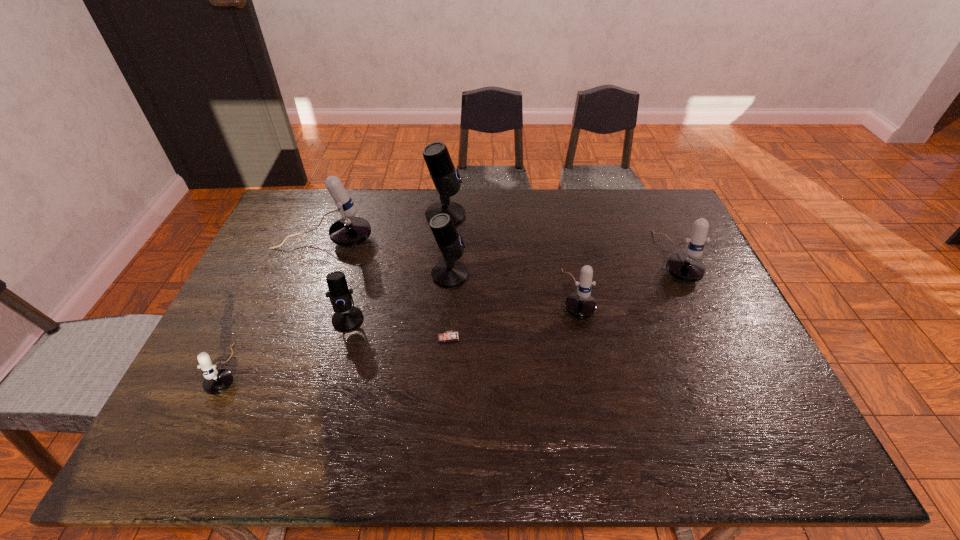
Point out which object is positioned as the sixth nearest to the leftmost black microphone. Please provide its 2D coordinates. Your answer should be formatted as a tuple, i.e. [(x, y)], where the tuple contains the x and y coordinates of a point satisfying the conditions above.

[(580, 304)]

This screenshot has height=540, width=960. I want to click on the fifth closest microphone relative to the farthest black microphone, so click(x=687, y=267).

Identify which microphone is the fifth nearest to the rightmost white microphone. Please provide its 2D coordinates. Your answer should be formatted as a tuple, i.e. [(x, y)], where the tuple contains the x and y coordinates of a point satisfying the conditions above.

[(350, 230)]

Select which black microphone is the closest to the seventh tallest object. Please provide its 2D coordinates. Your answer should be formatted as a tuple, i.e. [(x, y)], where the tuple contains the x and y coordinates of a point satisfying the conditions above.

[(346, 317)]

Locate an element on the screen. This screenshot has height=540, width=960. the third closest black microphone to the biggest white microphone is located at coordinates (346, 317).

You are a GUI agent. You are given a task and a screenshot of the screen. Output one action in this format:
    pyautogui.click(x=<x>, y=<y>)
    Task: Click on the white microphone that is the second closest to the farthest black microphone
    Image resolution: width=960 pixels, height=540 pixels.
    Given the screenshot: What is the action you would take?
    pyautogui.click(x=580, y=304)

The height and width of the screenshot is (540, 960). What are the coordinates of `white microphone that is the third closest to the shortest object` in the screenshot? It's located at (216, 381).

Locate an element on the screen. The height and width of the screenshot is (540, 960). free space that satisfies the following two spatial constraints: 1. on the back side of the shortest object; 2. on the left side of the second object from right to left is located at coordinates (451, 294).

Identify the location of blank area in the image that satisfies the following two spatial constraints: 1. on the stand of the second smallest white microphone; 2. on the right side of the biggest black microphone. This screenshot has width=960, height=540. (438, 294).

Identify the location of vacant space that satisfies the following two spatial constraints: 1. on the stand of the second smallest black microphone; 2. on the back side of the seventh farthest object. point(445,337).